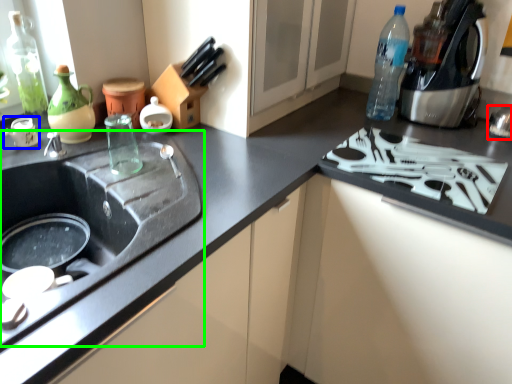
Question: Estimate the real-world distances between objects in this image. Which object is closer to appliance (highlighted by a red box), appliance (highlighted by a blue box) or sink (highlighted by a green box)?

Choices:
 (A) appliance
 (B) sink

Answer: (B)